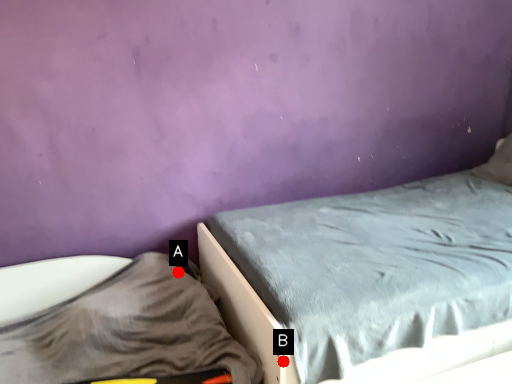
Question: Two points are circled on the image, labeled by A and B beside each circle. Which of the following is the closest to the observer?

Choices:
 (A) A is closer
 (B) B is closer

Answer: (B)